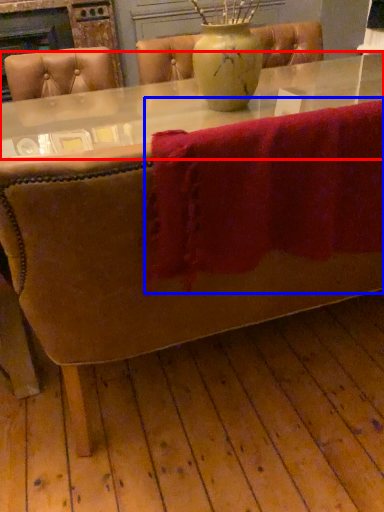
Question: Which point is further to the camera, round table (highlighted by a red box) or bath towel (highlighted by a blue box)?

Choices:
 (A) round table
 (B) bath towel

Answer: (A)